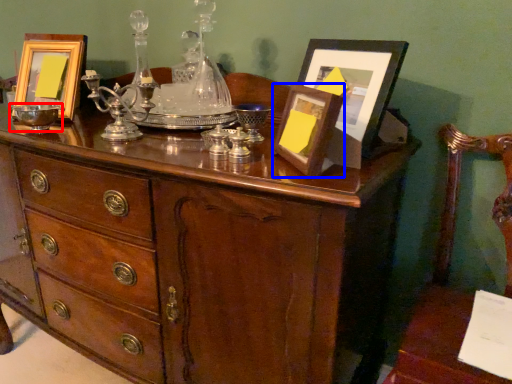
Question: Which object is closer to the camera taking this photo, glass bowl (highlighted by a red box) or picture frame (highlighted by a blue box)?

Choices:
 (A) glass bowl
 (B) picture frame

Answer: (B)